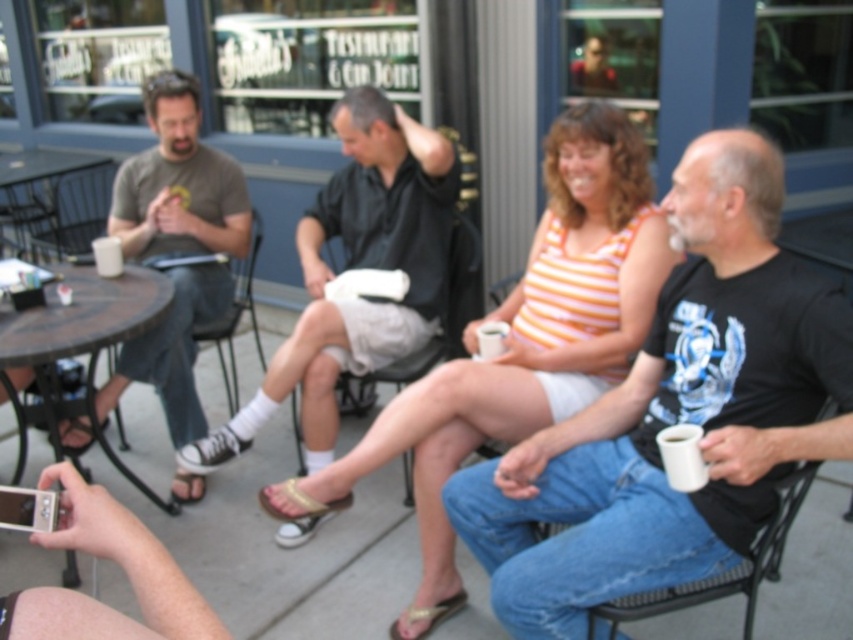
You are a photographer trying to capture a clear shot of the gold leather sandal at lower center without the black canvas shoe at center blocking it. What adjustment should you make to your camera position?

Move the camera position backward to create more distance between the camera and the black canvas shoe at center, allowing the gold leather sandal at lower center to become visible behind it.